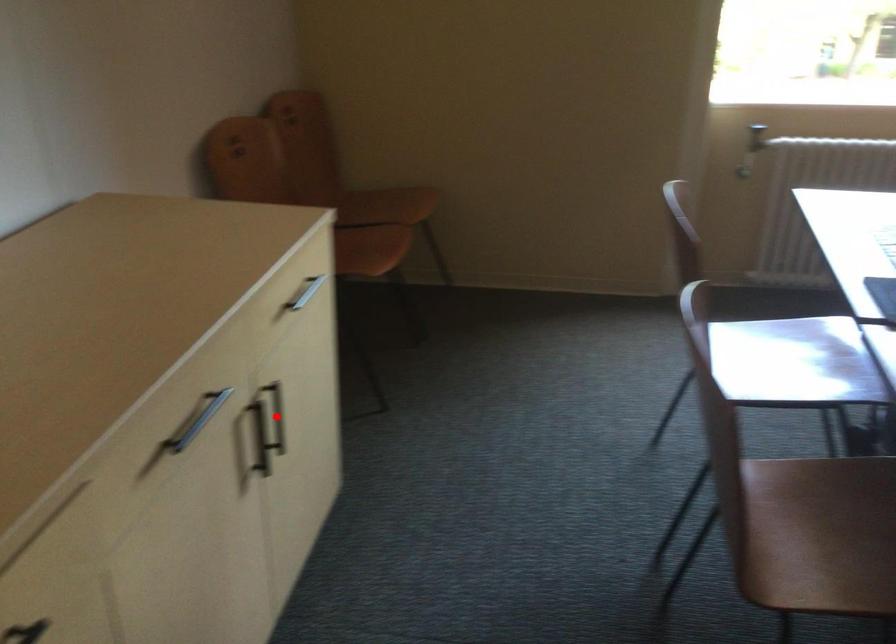
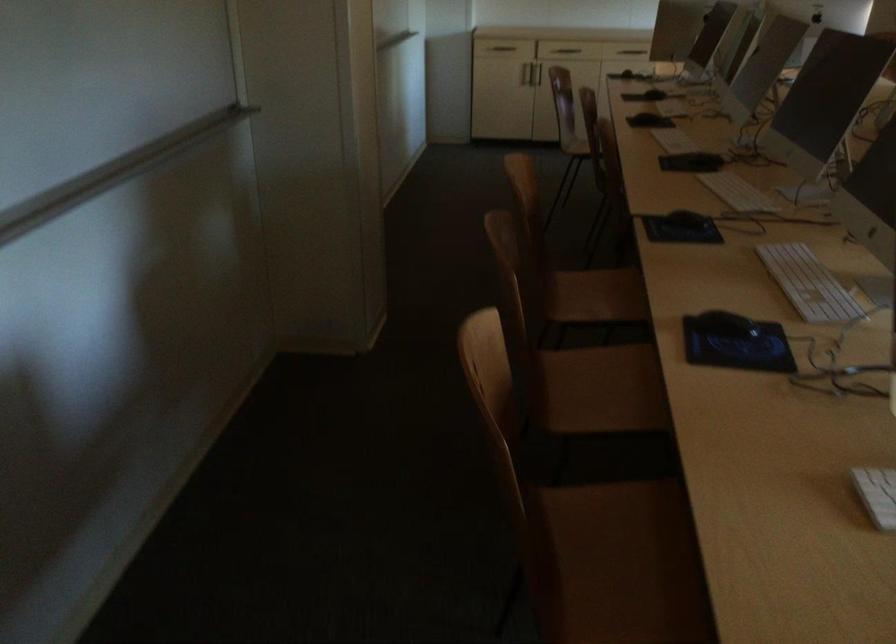
Question: I am providing you with two images of the same scene from different viewpoints. A red point is marked on the first image. Is the red point's position out of view in image 2?

Choices:
 (A) Yes
 (B) No

Answer: (A)